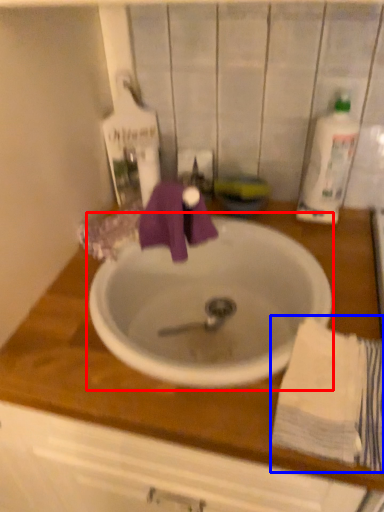
Question: Which object appears farthest to the camera in this image, sink (highlighted by a red box) or bath towel (highlighted by a blue box)?

Choices:
 (A) sink
 (B) bath towel

Answer: (A)